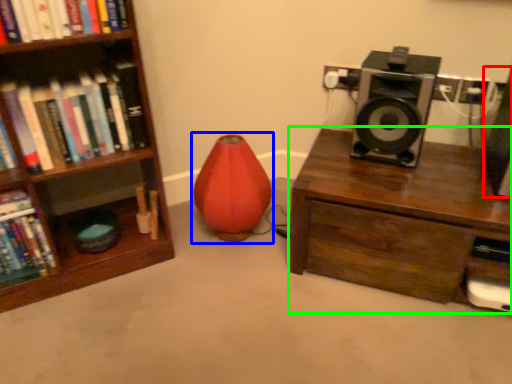
Question: Which object is positioned farthest from speaker (highlighted by a red box)? Select from bean bag chair (highlighted by a blue box) and desk (highlighted by a green box).

Choices:
 (A) bean bag chair
 (B) desk

Answer: (A)